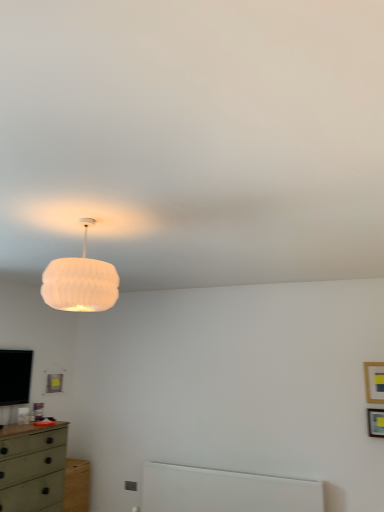
Question: From the image's perspective, would you say wooden picture frame at upper right, the 2th picture frame ordered from the bottom, is shown under wooden picture frame at upper right, which appears as the second picture frame when viewed from the top?

Choices:
 (A) yes
 (B) no

Answer: (B)

Question: Is wooden picture frame at upper right, which is the first picture frame from top to bottom, not near wooden picture frame at upper right, positioned as the first picture frame in bottom-to-top order?

Choices:
 (A) yes
 (B) no

Answer: (B)

Question: From a real-world perspective, is wooden picture frame at upper right, the 2th picture frame ordered from the bottom, over wooden picture frame at upper right, which appears as the second picture frame when viewed from the top?

Choices:
 (A) yes
 (B) no

Answer: (A)

Question: Does wooden picture frame at upper right, the 2th picture frame ordered from the bottom, have a larger size compared to wooden picture frame at upper right, which appears as the second picture frame when viewed from the top?

Choices:
 (A) yes
 (B) no

Answer: (B)

Question: Could you tell me if wooden picture frame at upper right, which is the first picture frame from top to bottom, is facing wooden picture frame at upper right, positioned as the first picture frame in bottom-to-top order?

Choices:
 (A) yes
 (B) no

Answer: (B)

Question: Does wooden picture frame at upper right, which is the first picture frame from top to bottom, have a greater width compared to wooden picture frame at upper right, positioned as the first picture frame in bottom-to-top order?

Choices:
 (A) yes
 (B) no

Answer: (B)

Question: Is wooden picture frame at upper right, which appears as the second picture frame when viewed from the top, at the right side of white ribbed shade at upper center?

Choices:
 (A) yes
 (B) no

Answer: (A)

Question: Is wooden picture frame at upper right, which appears as the second picture frame when viewed from the top, looking in the opposite direction of white ribbed shade at upper center?

Choices:
 (A) no
 (B) yes

Answer: (A)

Question: Can you see wooden picture frame at upper right, which appears as the second picture frame when viewed from the top, touching white ribbed shade at upper center?

Choices:
 (A) yes
 (B) no

Answer: (B)

Question: Does wooden picture frame at upper right, positioned as the first picture frame in bottom-to-top order, have a greater width compared to white ribbed shade at upper center?

Choices:
 (A) yes
 (B) no

Answer: (B)

Question: Is wooden picture frame at upper right, positioned as the first picture frame in bottom-to-top order, taller than white ribbed shade at upper center?

Choices:
 (A) yes
 (B) no

Answer: (B)

Question: Considering the relative sizes of wooden picture frame at upper right, positioned as the first picture frame in bottom-to-top order, and white ribbed shade at upper center in the image provided, is wooden picture frame at upper right, positioned as the first picture frame in bottom-to-top order, bigger than white ribbed shade at upper center?

Choices:
 (A) no
 (B) yes

Answer: (A)

Question: Can you confirm if white ribbed shade at upper center is taller than green matte chest of drawers at lower left?

Choices:
 (A) yes
 (B) no

Answer: (B)